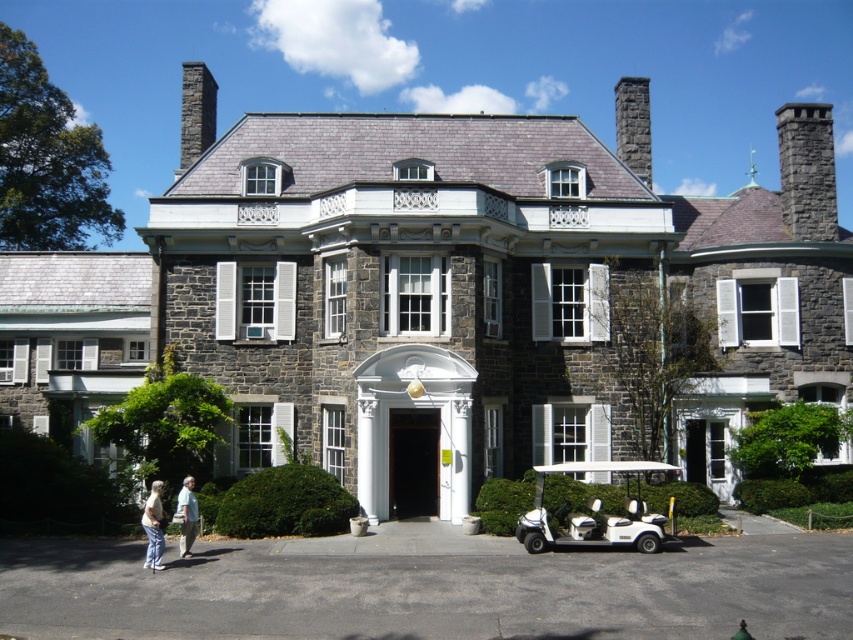
Does stone mansion at center have a smaller size compared to white cotton shirt at lower left?

Incorrect, stone mansion at center is not smaller in size than white cotton shirt at lower left.

Between stone mansion at center and white cotton shirt at lower left, which one has more height?

Standing taller between the two is stone mansion at center.

Is point (270, 218) behind point (151, 556)?

Yes, point (270, 218) is behind point (151, 556).

Identify the location of stone mansion at center. This screenshot has width=853, height=640. (444, 298).

Which is behind, point (639, 545) or point (158, 500)?

Point (639, 545)

Which is more to the left, white plastic golf cart at lower right or white cotton shirt at lower left?

From the viewer's perspective, white cotton shirt at lower left appears more on the left side.

Between point (592, 529) and point (148, 512), which one is positioned in front?

Point (148, 512)

Where is `white plastic golf cart at lower right`? white plastic golf cart at lower right is located at coordinates (593, 513).

Does stone mansion at center have a greater width compared to white fabric at lower left?

Yes.

Is point (265, 448) farther from viewer compared to point (184, 554)?

That is True.

Is point (393, 115) farther from camera compared to point (184, 524)?

Yes, it is.

Where is `stone mansion at center`? stone mansion at center is located at coordinates (444, 298).